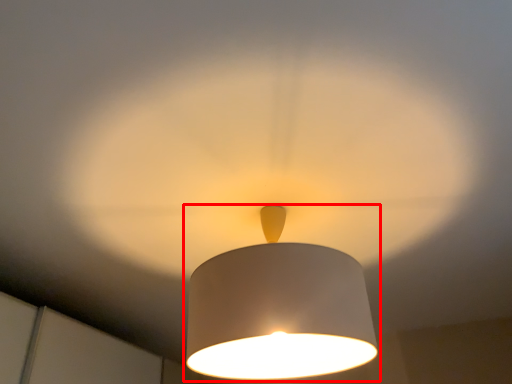
Question: From the image, what is the correct spatial relationship of lamp (annotated by the red box) in relation to glow?

Choices:
 (A) right
 (B) left

Answer: (A)